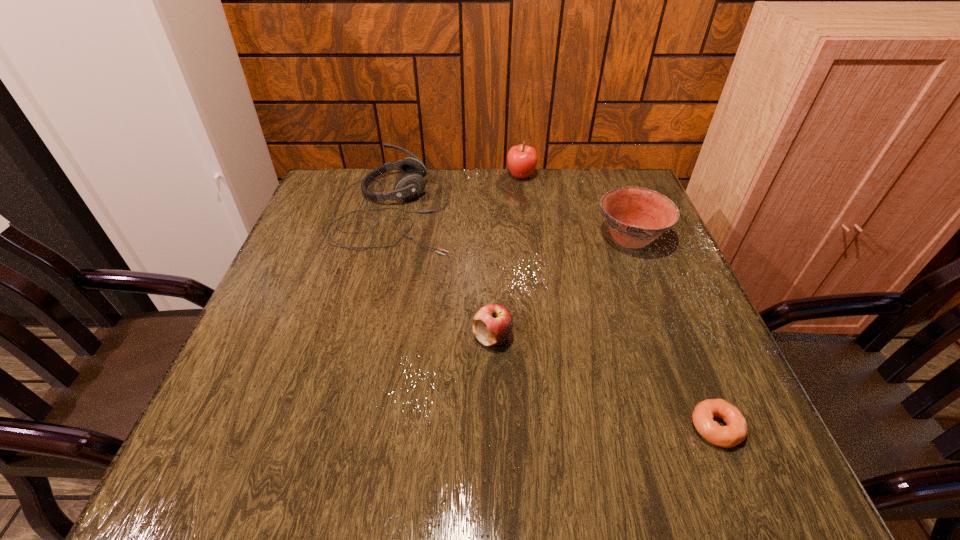
The height and width of the screenshot is (540, 960). Identify the location of vacant area between the shortest object and the right apple. (x=618, y=302).

Locate an element on the screen. The width and height of the screenshot is (960, 540). empty space between the farther apple and the left apple is located at coordinates (507, 256).

In order to click on vacant region between the leftmost object and the left apple in this screenshot , I will do `click(443, 273)`.

What are the coordinates of `vacant space in between the right apple and the left apple` in the screenshot? It's located at (507, 256).

I want to click on free space between the left apple and the right apple, so click(x=507, y=256).

Find the location of a particular element. The image size is (960, 540). vacant region between the shortest object and the bowl is located at coordinates (673, 333).

Find the location of a particular element. The image size is (960, 540). free space between the third object from right to left and the headset is located at coordinates coord(457,192).

Where is `empty location between the bowl and the doughnut`? The width and height of the screenshot is (960, 540). empty location between the bowl and the doughnut is located at coordinates (673, 333).

Where is `free space between the third object from left to right and the nearest object`? free space between the third object from left to right and the nearest object is located at coordinates (618, 302).

Find the location of a particular element. the fourth closest object to the bowl is located at coordinates (736, 429).